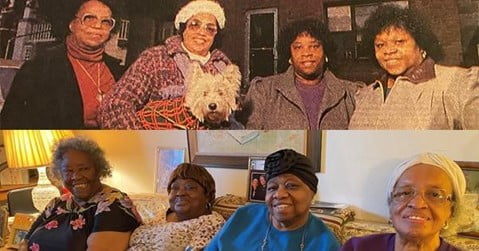
You are a GUI agent. You are given a task and a screenshot of the screen. Output one action in this format:
    pyautogui.click(x=<x>, y=<y>)
    Task: Click on the wall art
    The width and height of the screenshot is (479, 251).
    Given the screenshot: What is the action you would take?
    pyautogui.click(x=230, y=140)